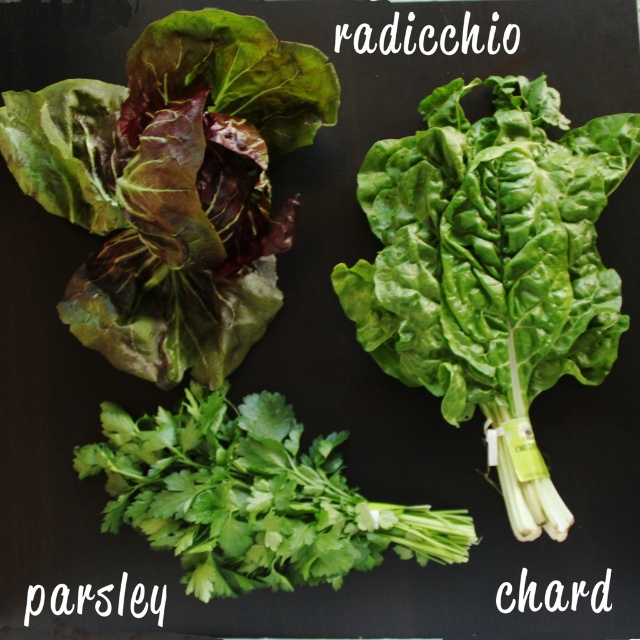
Does green leafy chard at center have a smaller size compared to green leafy parsley at lower center?

Incorrect, green leafy chard at center is not smaller in size than green leafy parsley at lower center.

What do you see at coordinates (492, 268) in the screenshot?
I see `green leafy chard at center` at bounding box center [492, 268].

This screenshot has width=640, height=640. I want to click on green leafy chard at center, so click(x=492, y=268).

Does dark green leafy at upper left appear on the right side of green leafy chard at center?

No, dark green leafy at upper left is not to the right of green leafy chard at center.

Does dark green leafy at upper left have a lesser width compared to green leafy chard at center?

No.

Is point (292, 51) behind point (339, 300)?

No, (292, 51) is closer to viewer.

What are the coordinates of `dark green leafy at upper left` in the screenshot? It's located at (x=173, y=186).

Based on the photo, which is below, dark green leafy at upper left or green leafy parsley at lower center?

green leafy parsley at lower center is below.

Can you confirm if dark green leafy at upper left is bigger than green leafy parsley at lower center?

Correct, dark green leafy at upper left is larger in size than green leafy parsley at lower center.

Locate an element on the screen. Image resolution: width=640 pixels, height=640 pixels. dark green leafy at upper left is located at coordinates (173, 186).